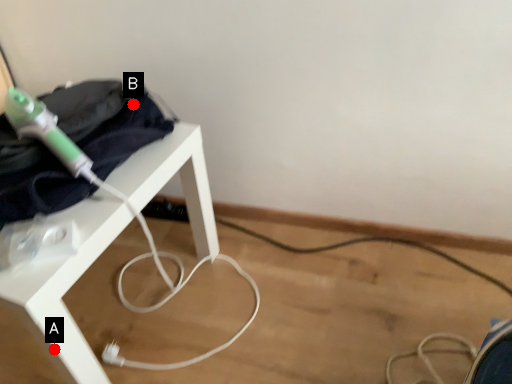
Question: Two points are circled on the image, labeled by A and B beside each circle. Which point is closer to the camera taking this photo?

Choices:
 (A) A is closer
 (B) B is closer

Answer: (A)